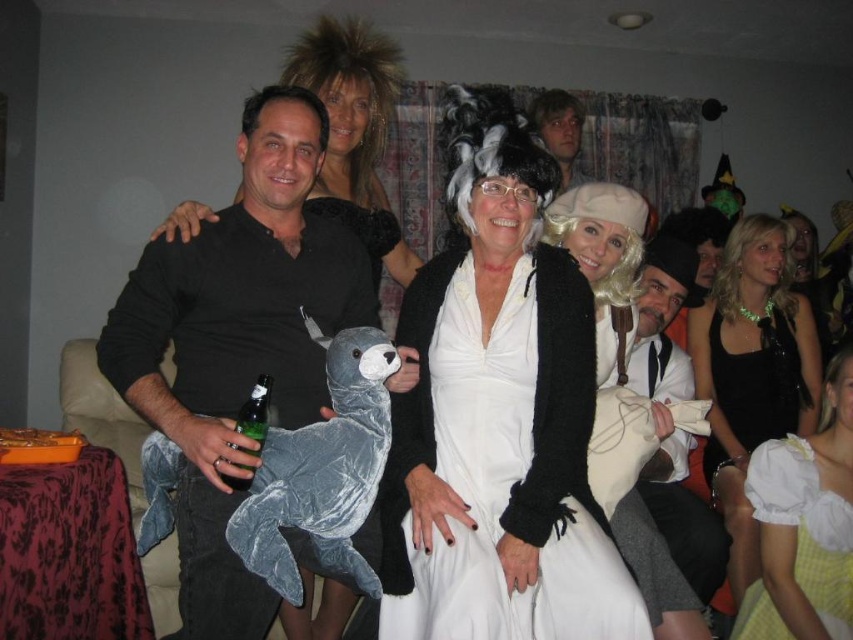
Can you confirm if black satin dress at lower right is thinner than white matte wig at upper center?

Yes.

This screenshot has height=640, width=853. What do you see at coordinates (752, 371) in the screenshot?
I see `black satin dress at lower right` at bounding box center [752, 371].

The height and width of the screenshot is (640, 853). Find the location of `black satin dress at lower right`. black satin dress at lower right is located at coordinates (752, 371).

Image resolution: width=853 pixels, height=640 pixels. Identify the location of black satin dress at lower right. (752, 371).

In the scene shown: Who is lower down, black satin dress at lower right or yellow cotton dress at lower right?

yellow cotton dress at lower right is lower down.

Is black satin dress at lower right shorter than yellow cotton dress at lower right?

No, black satin dress at lower right is not shorter than yellow cotton dress at lower right.

Locate an element on the screen. Image resolution: width=853 pixels, height=640 pixels. black satin dress at lower right is located at coordinates (752, 371).

The image size is (853, 640). What are the coordinates of `black satin dress at lower right` in the screenshot? It's located at (752, 371).

Can you confirm if white matte dress at center is wider than black satin dress at center?

Yes.

Is point (396, 401) less distant than point (759, 401)?

That is True.

Locate an element on the screen. white matte dress at center is located at coordinates (498, 417).